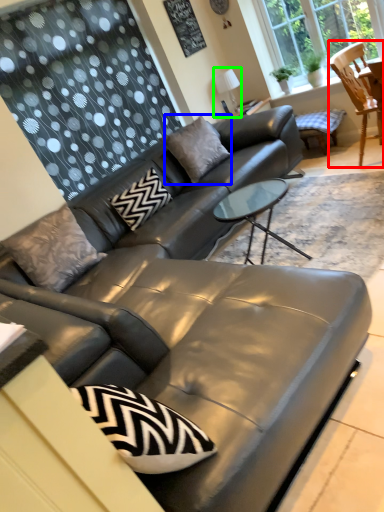
Question: Which is farther away from chair (highlighted by a red box)? pillow (highlighted by a blue box) or lamp (highlighted by a green box)?

Choices:
 (A) pillow
 (B) lamp

Answer: (B)